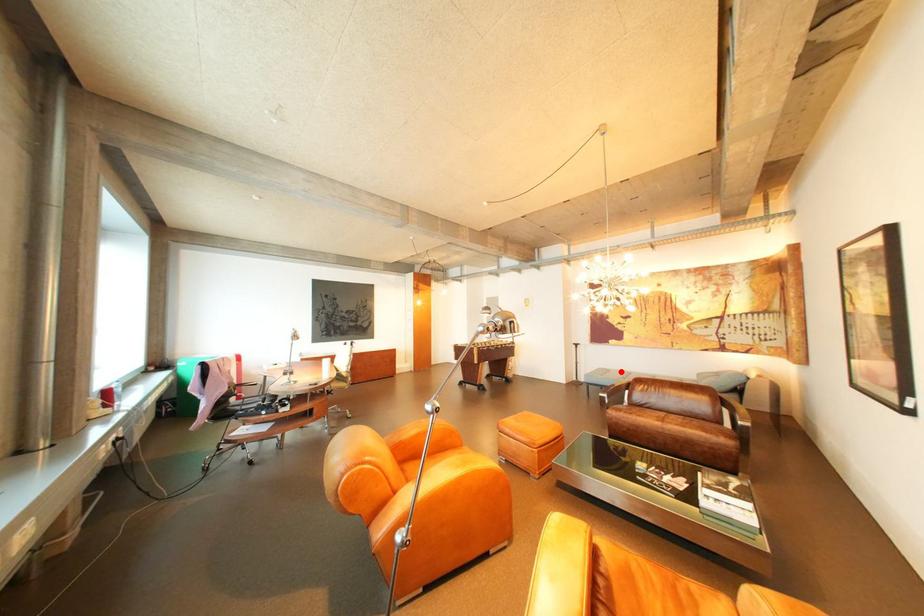
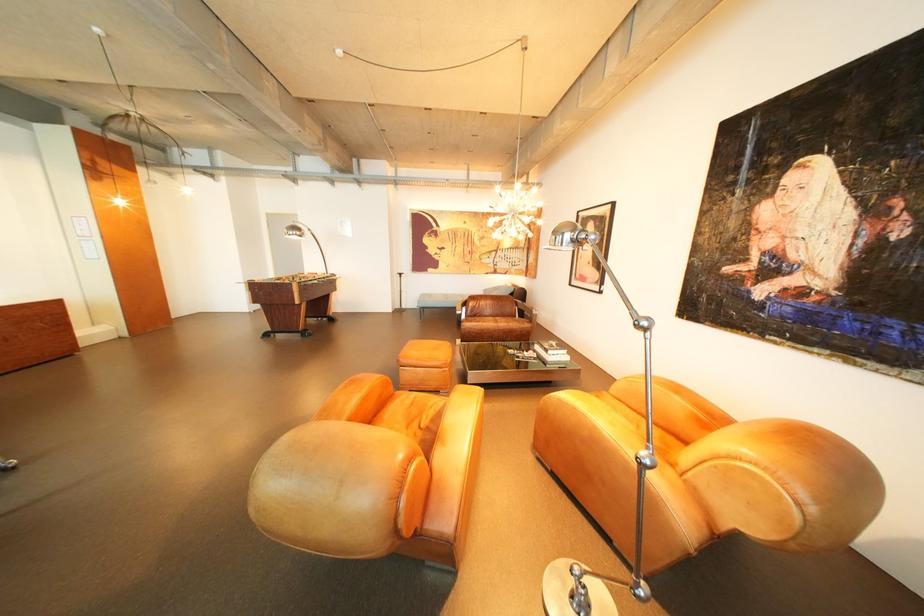
Find the pixel in the second image that matches the highlighted location in the first image.

(444, 296)